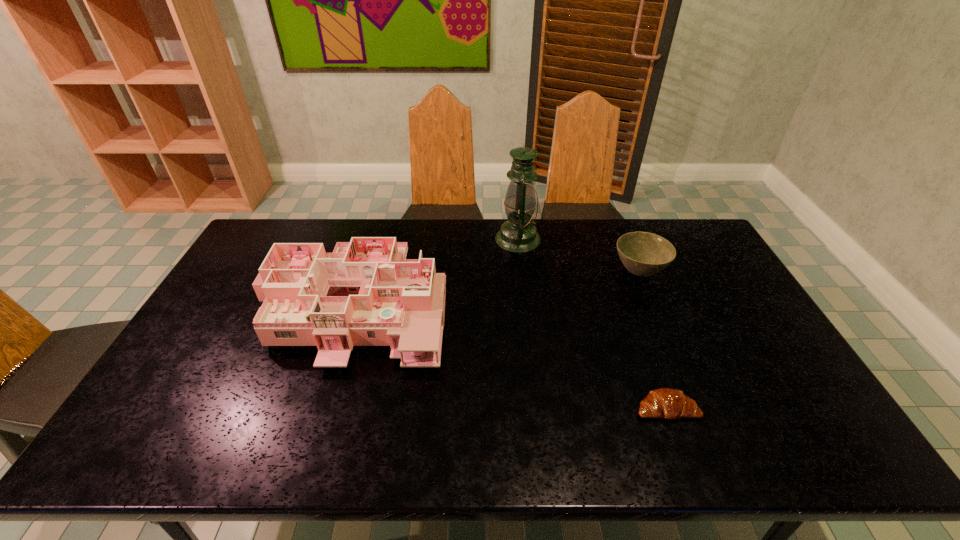
The image size is (960, 540). What are the coordinates of `vacant space situated on the left of the shortest object` in the screenshot? It's located at (489, 409).

I want to click on oil lamp at the far edge, so click(x=518, y=235).

The image size is (960, 540). Identify the location of dollhouse that is at the far edge. (366, 293).

Identify the location of bowl at the far edge. (643, 254).

I want to click on vacant space at the far edge, so click(432, 251).

Where is `blank area at the near edge`? The width and height of the screenshot is (960, 540). blank area at the near edge is located at coordinates (709, 450).

This screenshot has width=960, height=540. Find the location of `vacant space at the right edge`. vacant space at the right edge is located at coordinates tap(807, 422).

In the image, there is a desktop. At what (x,y) coordinates should I click in order to perform the action: click on free space at the far right corner. Please return your answer as a coordinate pair (x, y). The height and width of the screenshot is (540, 960). Looking at the image, I should click on 670,238.

Where is `free area in between the farthest object and the crescent roll`? The image size is (960, 540). free area in between the farthest object and the crescent roll is located at coordinates (592, 324).

The width and height of the screenshot is (960, 540). What are the coordinates of `vacant area that lies between the crescent roll and the leftmost object` in the screenshot? It's located at (511, 357).